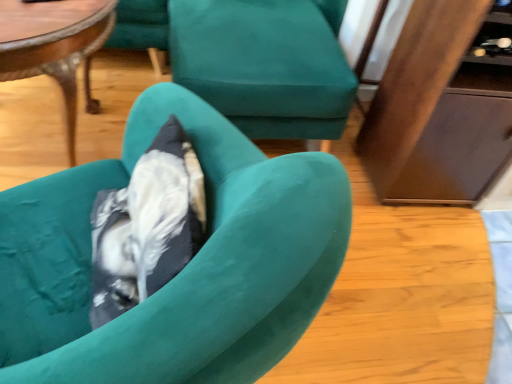
Question: Which direction should I rotate to look at velvet teal armchair at center, acting as the first chair starting from the front, — up or down?

Choices:
 (A) up
 (B) down

Answer: (B)

Question: From a real-world perspective, is velvet teal armchair at center, positioned as the first chair in bottom-to-top order, below wooden dresser at right?

Choices:
 (A) yes
 (B) no

Answer: (B)

Question: Is velvet teal armchair at center, acting as the first chair starting from the front, aimed at wooden dresser at right?

Choices:
 (A) no
 (B) yes

Answer: (A)

Question: From the image's perspective, is velvet teal armchair at center, positioned as the first chair in bottom-to-top order, on wooden dresser at right?

Choices:
 (A) no
 (B) yes

Answer: (A)

Question: Is velvet teal armchair at center, which ranks as the 2th chair in top-to-bottom order, far from wooden dresser at right?

Choices:
 (A) no
 (B) yes

Answer: (A)

Question: From a real-world perspective, is velvet teal armchair at center, acting as the first chair starting from the front, on wooden dresser at right?

Choices:
 (A) no
 (B) yes

Answer: (B)

Question: Is wooden dresser at right completely or partially inside velvet teal armchair at center, positioned as the first chair in bottom-to-top order?

Choices:
 (A) yes
 (B) no

Answer: (B)

Question: Is wooden dresser at right facing towards velvet teal armchair at center, which ranks as the 2th chair in top-to-bottom order?

Choices:
 (A) yes
 (B) no

Answer: (B)

Question: Can you confirm if wooden dresser at right is shorter than velvet teal armchair at center, positioned as the first chair in bottom-to-top order?

Choices:
 (A) yes
 (B) no

Answer: (B)

Question: Is wooden dresser at right directly adjacent to velvet teal armchair at center, acting as the first chair starting from the front?

Choices:
 (A) no
 (B) yes

Answer: (A)

Question: Could velvet teal armchair at center, positioned as the first chair in bottom-to-top order, be considered to be inside wooden dresser at right?

Choices:
 (A) yes
 (B) no

Answer: (B)

Question: Is wooden dresser at right not within velvet teal armchair at center, acting as the 2th chair starting from the back?

Choices:
 (A) yes
 (B) no

Answer: (A)

Question: Does wooden dresser at right lie behind velvet teal armchair at center, acting as the first chair starting from the front?

Choices:
 (A) yes
 (B) no

Answer: (A)

Question: Is wooden polished coffee table at upper left positioned before teal fabric chair at center, arranged as the first chair when viewed from the top?

Choices:
 (A) yes
 (B) no

Answer: (A)